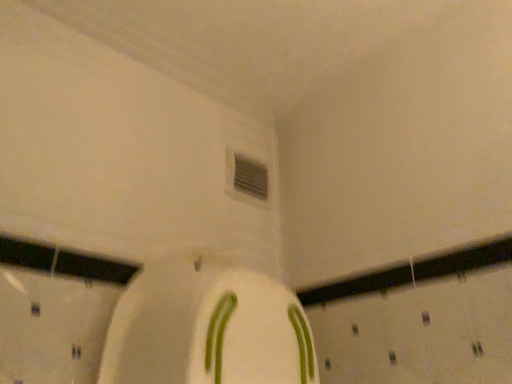
Question: Should I look upward or downward to see white matte paper towel at center?

Choices:
 (A) down
 (B) up

Answer: (A)